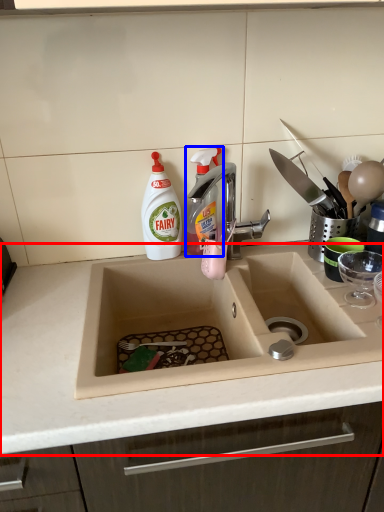
Question: Which object appears closest to the camera in this image, countertop (highlighted by a red box) or cleaning product (highlighted by a blue box)?

Choices:
 (A) countertop
 (B) cleaning product

Answer: (A)